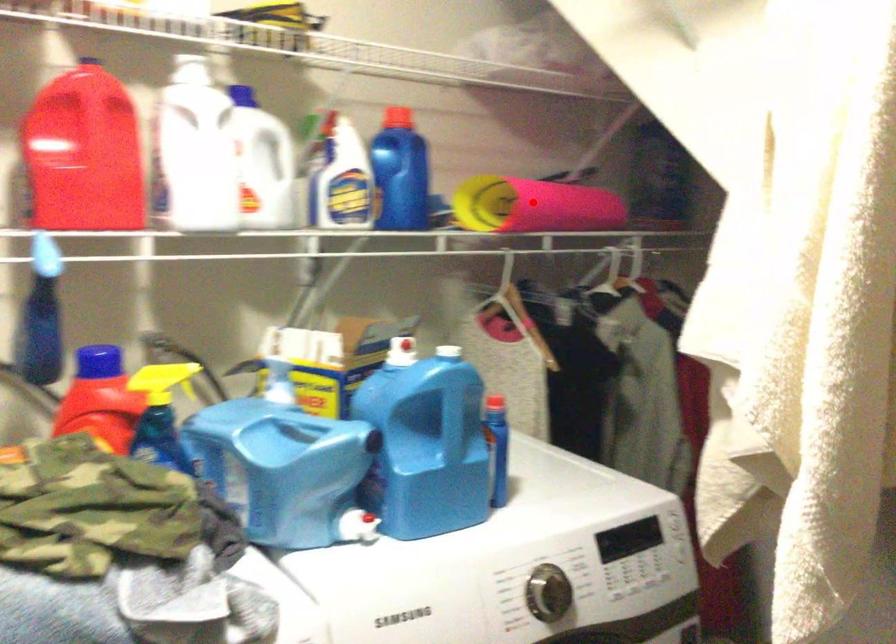
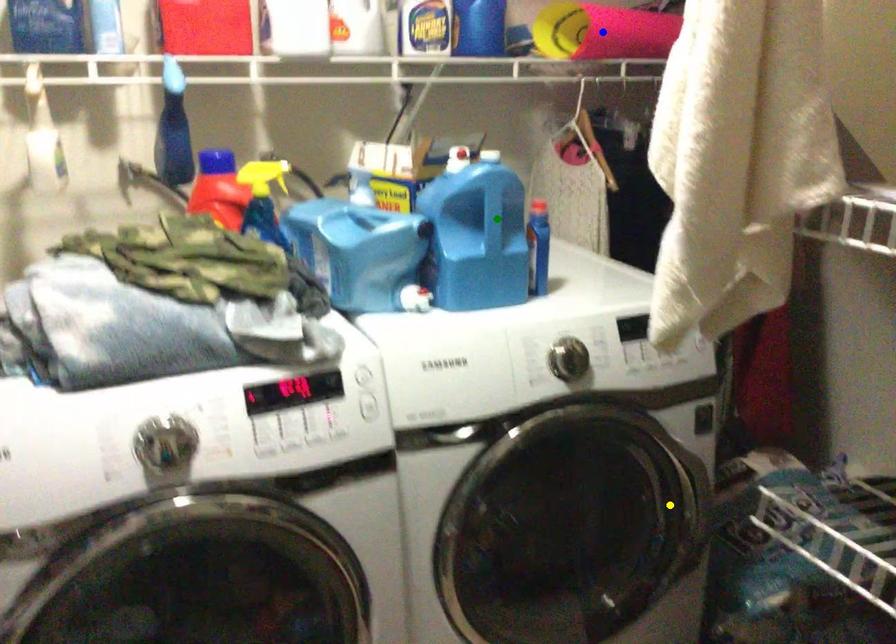
Question: I am providing you with two images of the same scene from different viewpoints. A red point is marked on the first image. You are given multiple points on the second image. Which point in image 2 represents the same 3d spot as the red point in image 1?

Choices:
 (A) green point
 (B) yellow point
 (C) blue point

Answer: (C)